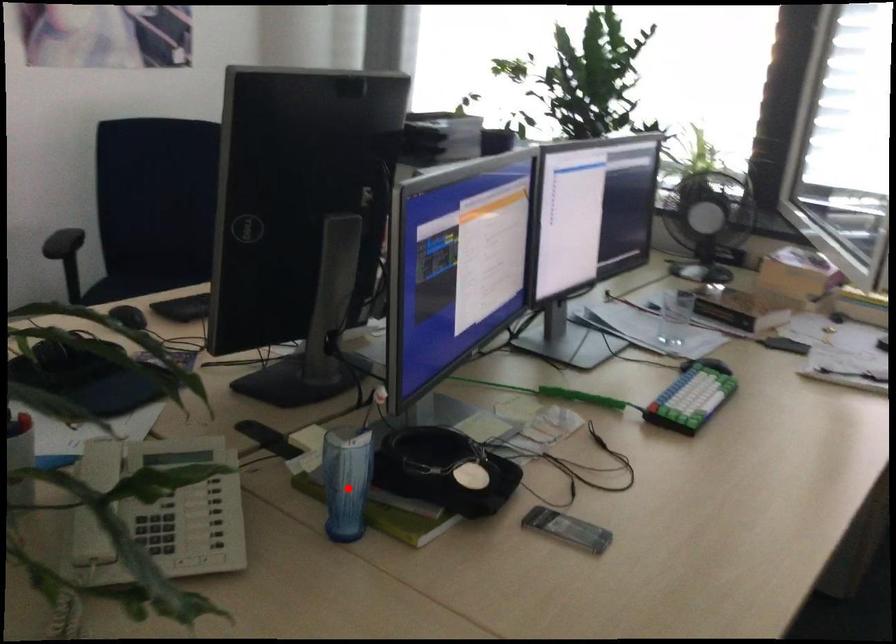
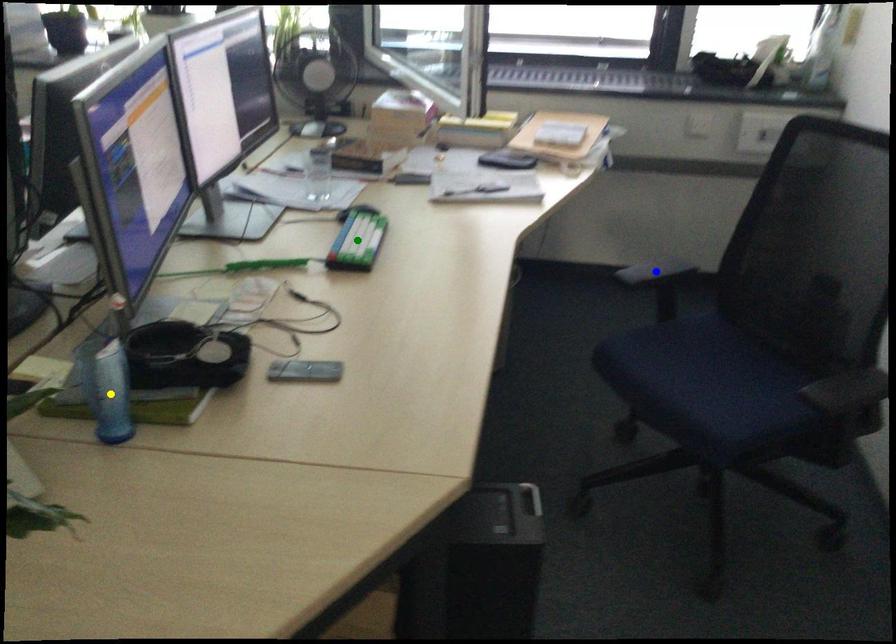
Question: I am providing you with two images of the same scene from different viewpoints. A red point is marked on the first image. You are given multiple points on the second image. In image 2, which mark is for the same physical point as the one in image 1?

Choices:
 (A) green point
 (B) yellow point
 (C) blue point

Answer: (B)